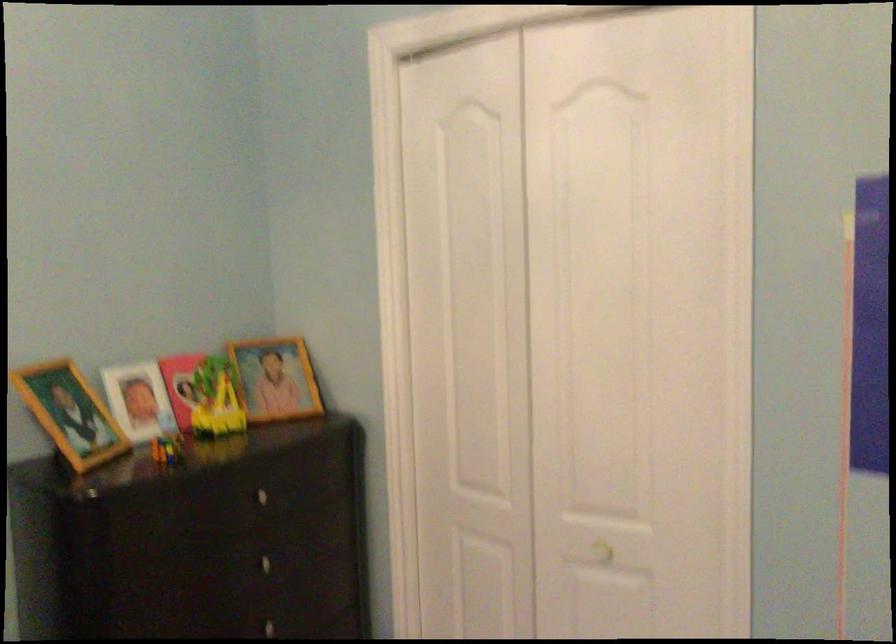
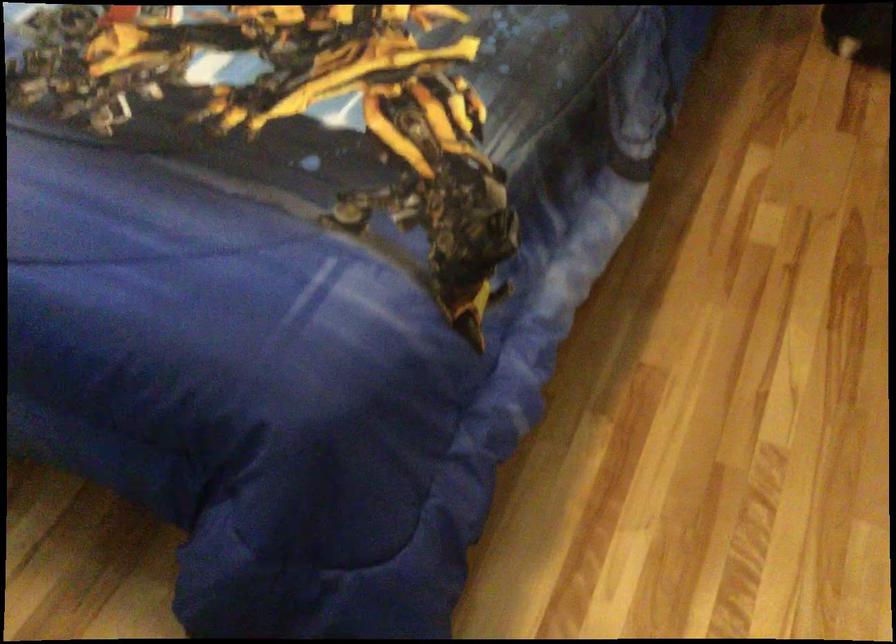
First-person continuous shooting, in which direction is the camera rotating?

The rotation direction of the camera is left-down.